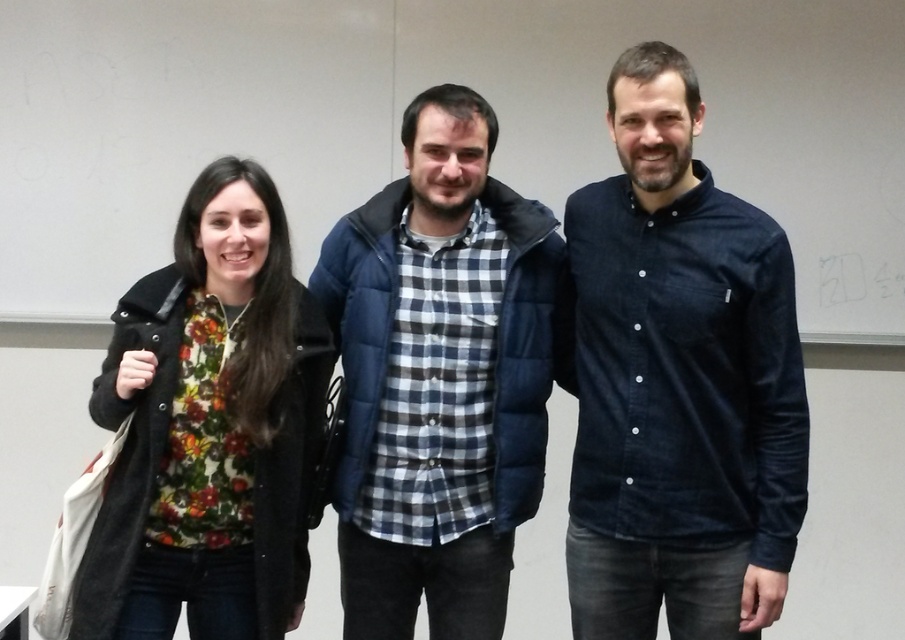
Question: Is checkered fabric shirt at center closer to camera compared to floral print shirt at left?

Choices:
 (A) no
 (B) yes

Answer: (A)

Question: Which of these objects is positioned farthest from the floral print shirt at left?

Choices:
 (A) dark blue button-up shirt at center
 (B) checkered fabric shirt at center

Answer: (A)

Question: Is dark blue button-up shirt at center below floral print shirt at left?

Choices:
 (A) no
 (B) yes

Answer: (A)

Question: Which point is farther from the camera taking this photo?

Choices:
 (A) (113, 580)
 (B) (499, 376)
 (C) (677, 188)

Answer: (B)

Question: Can you confirm if dark blue button-up shirt at center is bigger than floral print shirt at left?

Choices:
 (A) no
 (B) yes

Answer: (B)

Question: Which of the following is the farthest from the observer?

Choices:
 (A) floral print shirt at left
 (B) dark blue button-up shirt at center
 (C) checkered fabric shirt at center

Answer: (C)